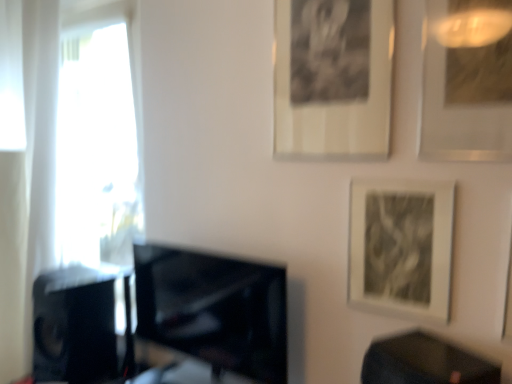
Question: Is point (388, 57) positioned closer to the camera than point (458, 130)?

Choices:
 (A) farther
 (B) closer

Answer: (A)

Question: From the image's perspective, is black matte picture frame at upper center, acting as the 3th picture frame starting from the right, positioned above or below metallic silver picture frame at upper right, positioned as the third picture frame in left-to-right order?

Choices:
 (A) above
 (B) below

Answer: (A)

Question: Which of these objects is positioned closest to the black glossy table at lower right?

Choices:
 (A) black glossy tv at center
 (B) black matte speaker at left
 (C) white sheer curtain at left
 (D) metallic silver picture frame at upper right, positioned as the third picture frame in left-to-right order
 (E) black matte picture frame at upper center, acting as the 3th picture frame starting from the right

Answer: (A)

Question: Which object is positioned closest to the matte black picture frame at lower right, which is the second picture frame from left to right?

Choices:
 (A) black glossy tv at center
 (B) black matte speaker at left
 (C) metallic silver picture frame at upper right, positioned as the third picture frame in left-to-right order
 (D) black matte picture frame at upper center, acting as the 3th picture frame starting from the right
 (E) white sheer curtain at left

Answer: (C)